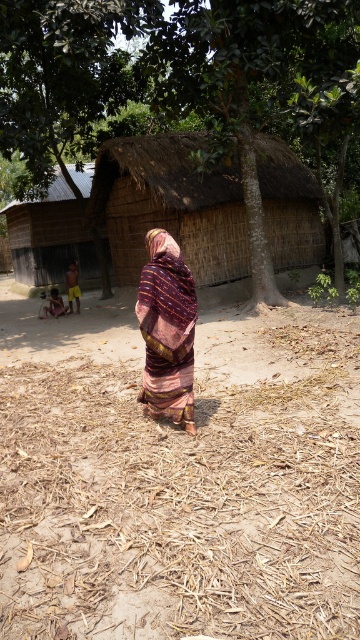
Is point (127, 156) positioned after point (182, 330)?

Yes, point (127, 156) is farther from viewer.

Between thatched straw hut at center and multicolored woven cloth at center, which one appears on the right side from the viewer's perspective?

Positioned to the right is thatched straw hut at center.

Between point (132, 173) and point (149, 365), which one is positioned in front?

Point (149, 365) is in front.

This screenshot has width=360, height=640. I want to click on thatched straw hut at center, so click(169, 205).

Does brown dry grass at center have a greater height compared to thatched straw hut at center?

No, brown dry grass at center is not taller than thatched straw hut at center.

At what (x,y) coordinates should I click in order to perform the action: click on brown dry grass at center. Please return your answer as a coordinate pair (x, y). Looking at the image, I should click on (185, 492).

Who is more distant from viewer, (285, 125) or (88, 280)?

Point (88, 280)

Can you confirm if green leafy tree at center is positioned to the right of dark brown wooden hut at left?

Indeed, green leafy tree at center is positioned on the right side of dark brown wooden hut at left.

Is point (240, 36) in front of point (74, 243)?

Yes, it is.

The width and height of the screenshot is (360, 640). In order to click on green leafy tree at center in this screenshot , I will do `click(181, 81)`.